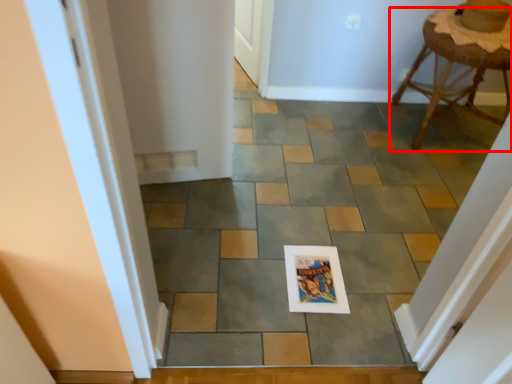
Question: In this image, where is stool (annotated by the red box) located relative to path?

Choices:
 (A) left
 (B) right

Answer: (B)